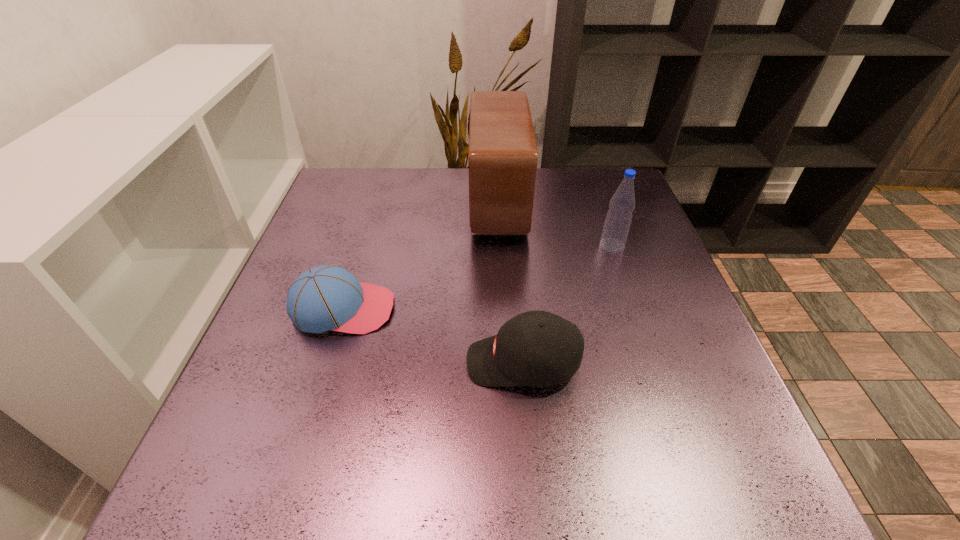
Find the location of a particular element. Image resolution: width=960 pixels, height=540 pixels. the tallest object is located at coordinates (503, 156).

What are the coordinates of `the third shortest object` in the screenshot? It's located at (619, 216).

This screenshot has height=540, width=960. What are the coordinates of `the rightmost object` in the screenshot? It's located at (619, 216).

Identify the location of the right baseball cap. (536, 348).

Locate an element on the screen. This screenshot has width=960, height=540. the left baseball cap is located at coordinates (323, 298).

At what (x,y) coordinates should I click in order to perform the action: click on free space located on the front-facing side of the tallest object. Please return your answer as a coordinate pair (x, y). Looking at the image, I should click on (438, 202).

The image size is (960, 540). Find the location of `free location located on the front-facing side of the tallest object`. free location located on the front-facing side of the tallest object is located at coordinates (378, 202).

Locate an element on the screen. Image resolution: width=960 pixels, height=540 pixels. vacant space located 0.350m on the front-facing side of the tallest object is located at coordinates (342, 202).

The image size is (960, 540). In order to click on vacant space located on the left of the water bottle in this screenshot , I will do `click(470, 246)`.

The height and width of the screenshot is (540, 960). Find the location of `blank area located 0.310m with a logo on the front of the right baseball cap`. blank area located 0.310m with a logo on the front of the right baseball cap is located at coordinates (298, 362).